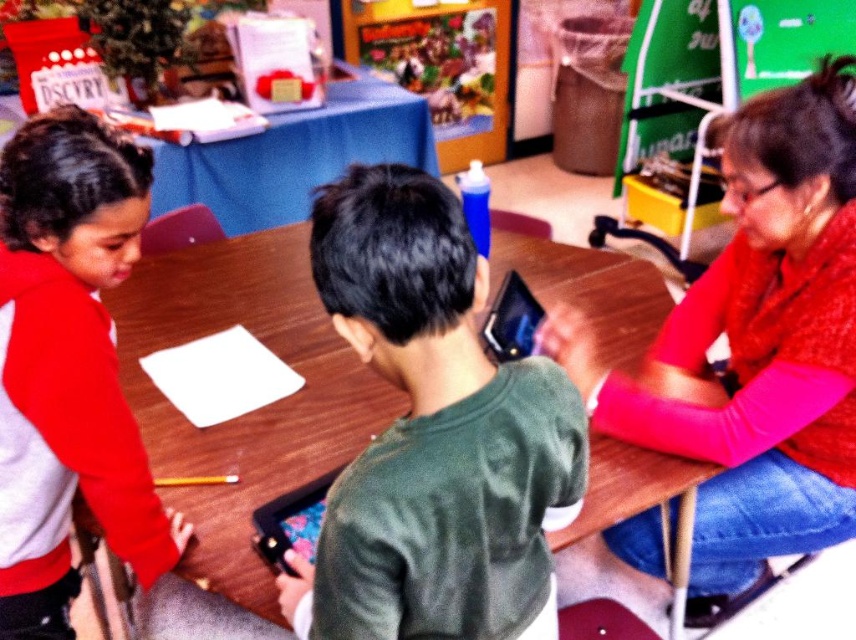
You are a student sitting at the back of the classroom and want to hand in your assignment to the teacher. You see the red sweater at right and the wooden poster at center. Which object is closer to you?

The red sweater at right is closer to you because it is in front of the wooden poster at center.

You are standing in the classroom and want to hand a book to the person wearing the green matte shirt at center. The book is on the wooden table at upper center. If you can reach 2 meters, can you reach the book and hand it to them without moving?

The green matte shirt at center is 2.11 meters away from the wooden table at upper center. Since your reach is 2 meters, you cannot reach the book on the wooden table at upper center and hand it to the green matte shirt at center without moving closer.